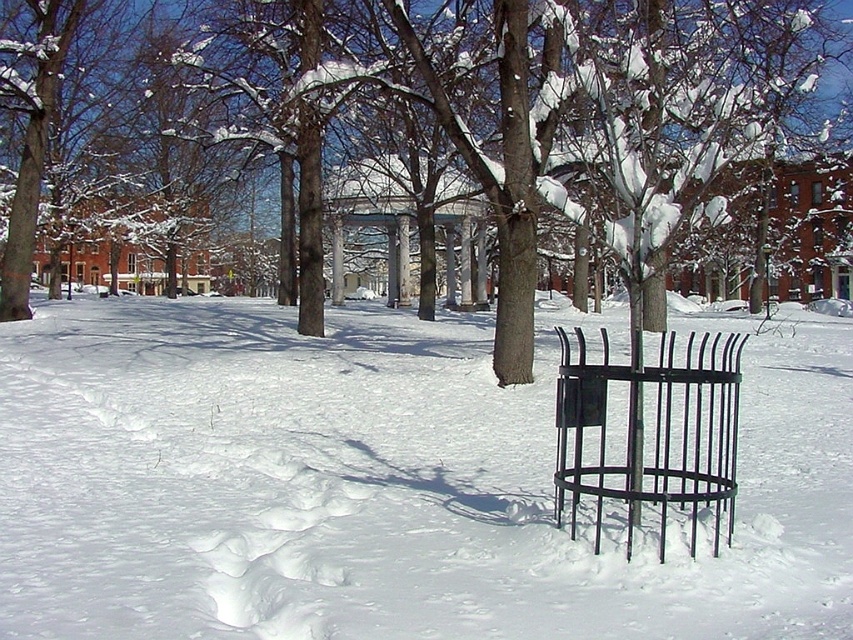
Question: Can you confirm if white matte snow at center is positioned to the right of black wrought iron trash can at center?

Choices:
 (A) no
 (B) yes

Answer: (A)

Question: Is white matte snow at center to the right of black wrought iron trash can at center from the viewer's perspective?

Choices:
 (A) yes
 (B) no

Answer: (B)

Question: Which point is farther from the camera taking this photo?

Choices:
 (A) 593,384
 (B) 376,394

Answer: (B)

Question: Which of the following is the farthest from the observer?

Choices:
 (A) white matte snow at center
 (B) black wrought iron trash can at center

Answer: (B)

Question: Can you confirm if white matte snow at center is positioned below black wrought iron trash can at center?

Choices:
 (A) yes
 (B) no

Answer: (B)